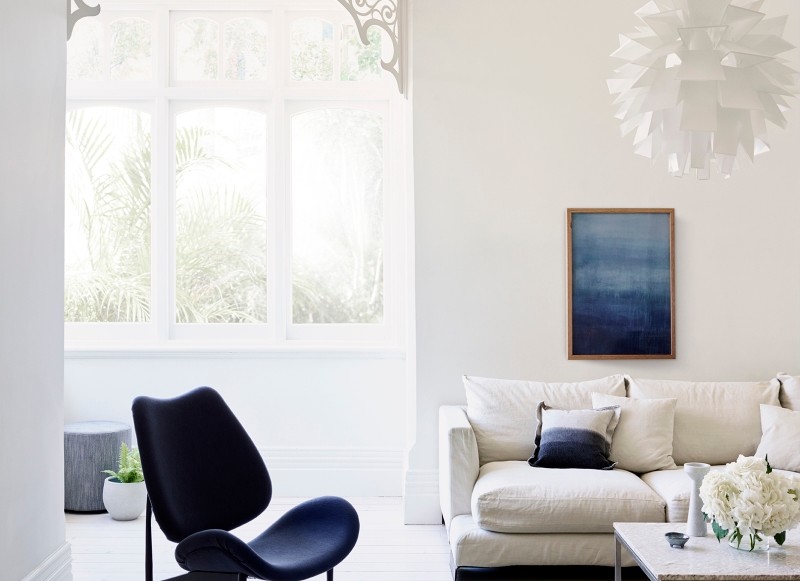
At what (x,y) coordinates should I click in order to perform the action: click on chair. Please return your answer as a coordinate pair (x, y). The width and height of the screenshot is (800, 581). Looking at the image, I should click on (300, 535).